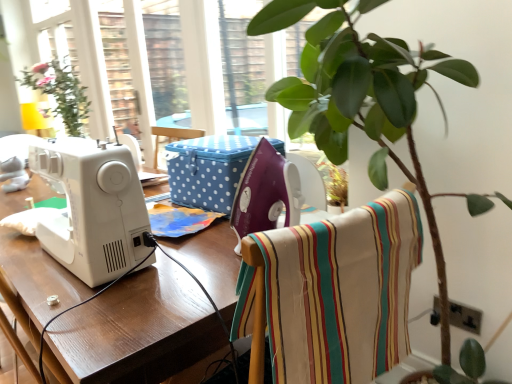
Question: Considering the positions of white plastic sewing machine at left, the first sewing machine positioned from the left, and striped cotton fabric at center in the image, is white plastic sewing machine at left, the first sewing machine positioned from the left, bigger or smaller than striped cotton fabric at center?

Choices:
 (A) small
 (B) big

Answer: (B)

Question: Is point (146, 253) positioned closer to the camera than point (324, 225)?

Choices:
 (A) closer
 (B) farther

Answer: (B)

Question: Based on their relative distances, which object is farther from the green glossy houseplant at upper right?

Choices:
 (A) white plastic sewing machine at left, the first sewing machine positioned from the left
 (B) blue polka dot fabric box at center
 (C) striped cotton fabric at center
 (D) white plastic sewing machine at center, placed as the first sewing machine when sorted from right to left
 (E) white glossy sewing machine at left

Answer: (A)

Question: Which is farther from the white plastic sewing machine at left, the first sewing machine positioned from the left?

Choices:
 (A) green glossy houseplant at upper right
 (B) white glossy sewing machine at left
 (C) white plastic sewing machine at center, placed as the first sewing machine when sorted from right to left
 (D) striped cotton fabric at center
 (E) blue polka dot fabric box at center

Answer: (A)